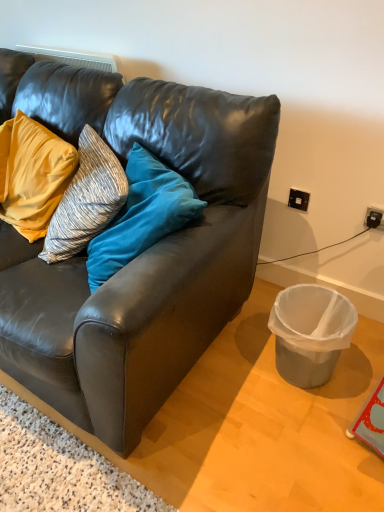
Question: Is matte yellow pillow at upper left not inside black plastic power outlet at upper right, the 1th power outlet positioned from the right?

Choices:
 (A) no
 (B) yes

Answer: (B)

Question: Considering the relative sizes of matte yellow pillow at upper left and black plastic power outlet at upper right, the 2th power outlet viewed from the left, in the image provided, is matte yellow pillow at upper left thinner than black plastic power outlet at upper right, the 2th power outlet viewed from the left,?

Choices:
 (A) yes
 (B) no

Answer: (B)

Question: Is matte yellow pillow at upper left smaller than black plastic power outlet at upper right, the 1th power outlet from the bottom?

Choices:
 (A) yes
 (B) no

Answer: (B)

Question: Is matte yellow pillow at upper left at the right side of black plastic power outlet at upper right, marked as the 2th power outlet in a back-to-front arrangement?

Choices:
 (A) no
 (B) yes

Answer: (A)

Question: Does matte yellow pillow at upper left have a greater height compared to black plastic power outlet at upper right, the 2th power outlet in the top-to-bottom sequence?

Choices:
 (A) yes
 (B) no

Answer: (A)

Question: From the image's perspective, is matte yellow pillow at upper left located above black plastic power outlet at upper right, the 1th power outlet from the bottom?

Choices:
 (A) yes
 (B) no

Answer: (A)

Question: From a real-world perspective, is black plastic power outlet at upper right, arranged as the first power outlet when viewed from the back, physically above black plastic power outlet at upper right, the 1th power outlet positioned from the right?

Choices:
 (A) no
 (B) yes

Answer: (B)

Question: From the image's perspective, is black plastic power outlet at upper right, which is the 2th power outlet in right-to-left order, under black plastic power outlet at upper right, the 1th power outlet from the bottom?

Choices:
 (A) yes
 (B) no

Answer: (B)

Question: From the image's perspective, is black plastic power outlet at upper right, which ranks as the first power outlet in left-to-right order, on black plastic power outlet at upper right, the 2th power outlet in the top-to-bottom sequence?

Choices:
 (A) yes
 (B) no

Answer: (A)

Question: From a real-world perspective, is black plastic power outlet at upper right, which is the second power outlet from front to back, physically below black plastic power outlet at upper right, which is the 1th power outlet in front-to-back order?

Choices:
 (A) yes
 (B) no

Answer: (B)

Question: Is black plastic power outlet at upper right, which ranks as the first power outlet in left-to-right order, oriented towards black plastic power outlet at upper right, the 2th power outlet in the top-to-bottom sequence?

Choices:
 (A) no
 (B) yes

Answer: (A)

Question: Is black plastic power outlet at upper right, which ranks as the first power outlet in left-to-right order, further to the viewer compared to black plastic power outlet at upper right, marked as the 2th power outlet in a back-to-front arrangement?

Choices:
 (A) no
 (B) yes

Answer: (B)

Question: Is metallic gray trash can at lower right thinner than black plastic power outlet at upper right, which is the 2th power outlet in right-to-left order?

Choices:
 (A) no
 (B) yes

Answer: (A)